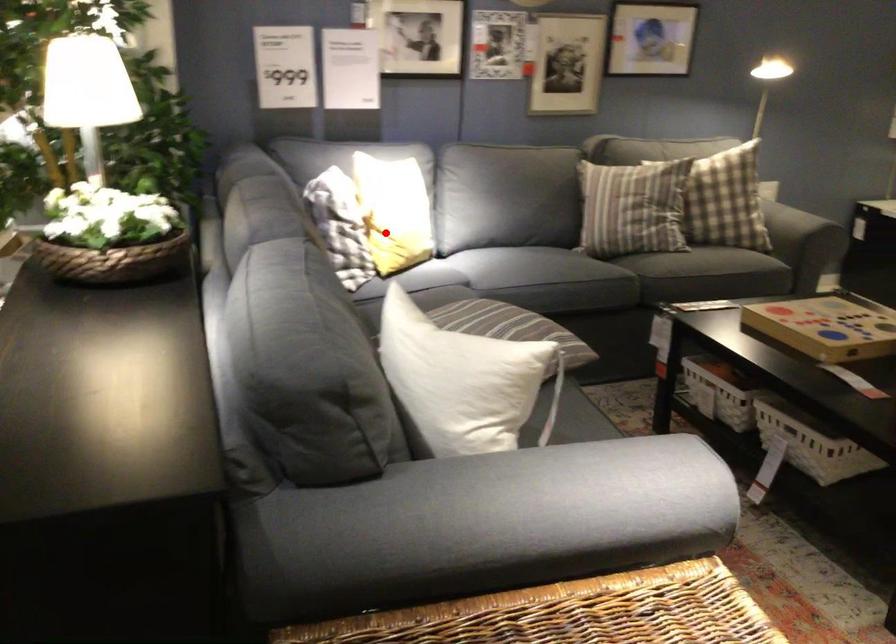
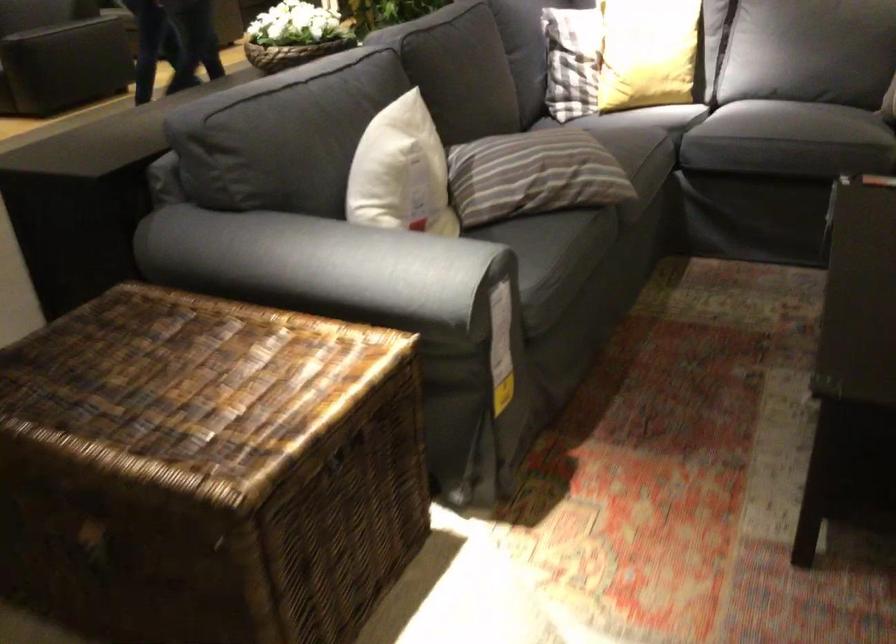
Locate, in the second image, the point that corresponds to the highlighted location in the first image.

(572, 61)